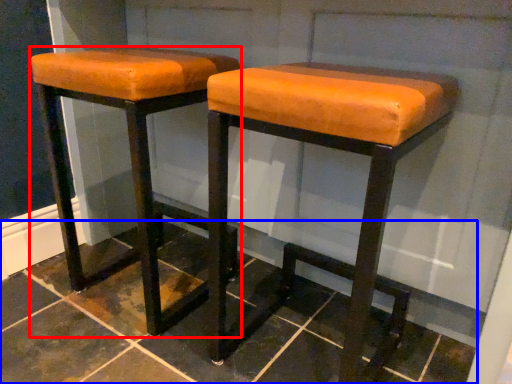
Question: Which point is further to the camera, stool (highlighted by a red box) or tile (highlighted by a blue box)?

Choices:
 (A) stool
 (B) tile

Answer: (A)